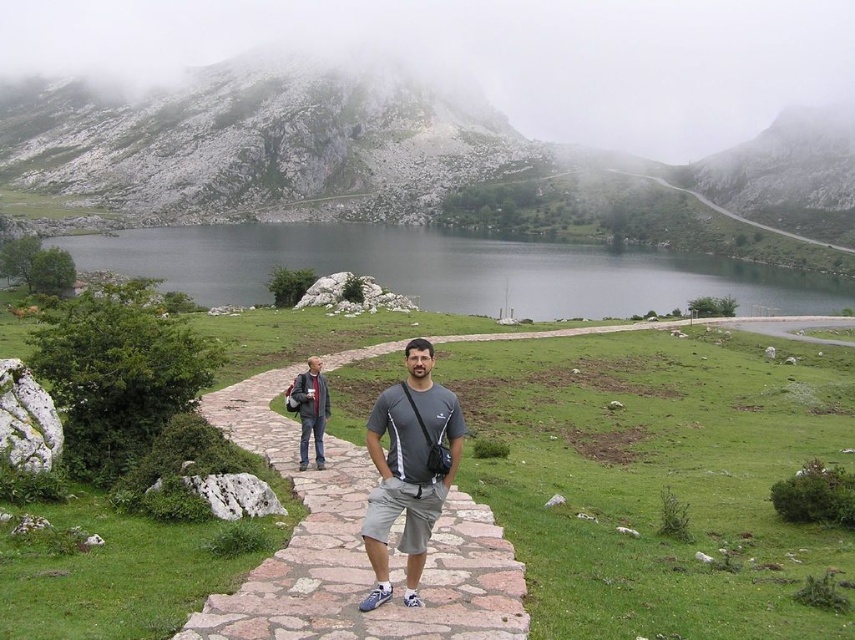
You are planning a hiking route and see the rocky gray mountain at upper left and the stone paved path at center. Which one would you choose to start your hike if you want to take the less challenging path?

You should choose the stone paved path at center because it is smaller and less challenging than the rocky gray mountain at upper left.